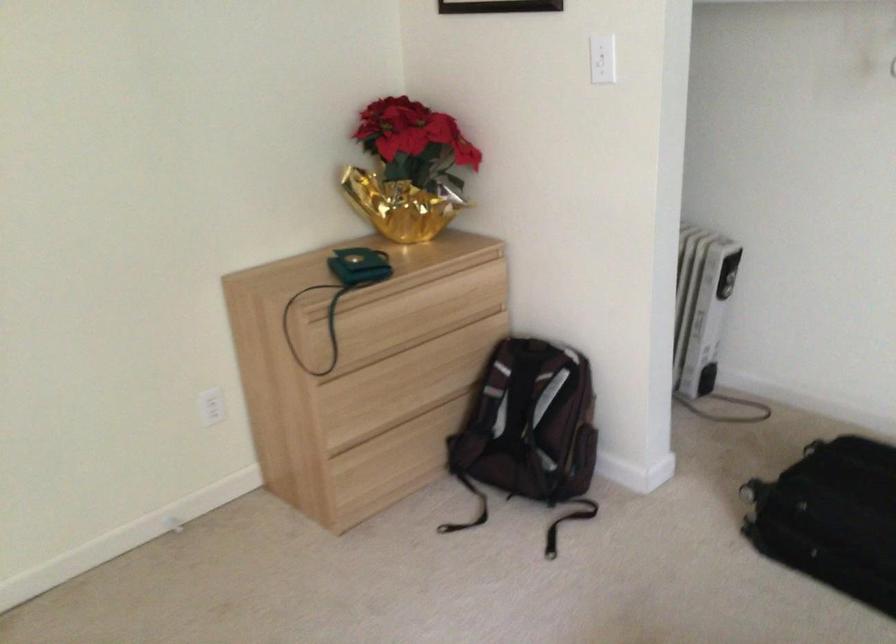
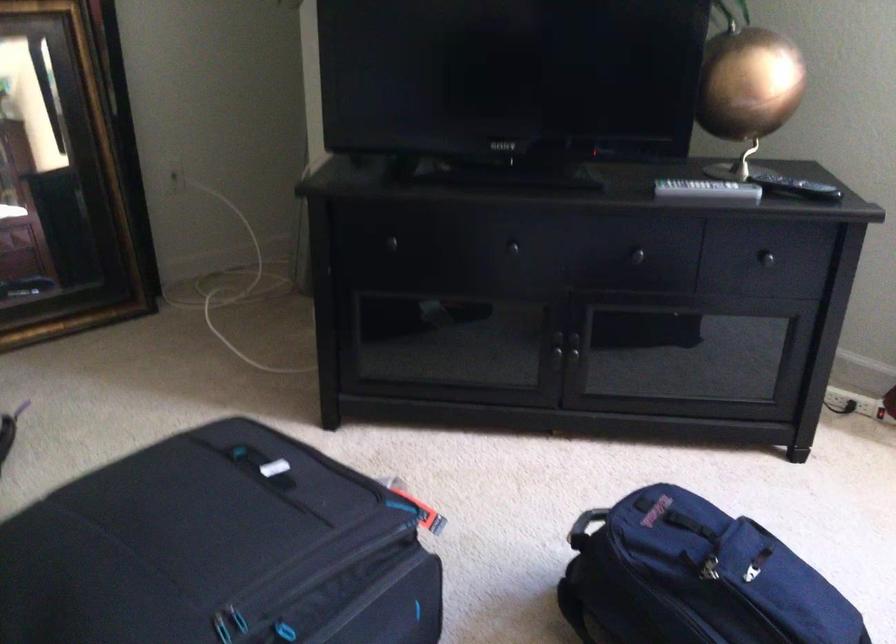
Question: The camera is either moving clockwise (left) or counter-clockwise (right) around the object. The first image is from the beginning of the video and the second image is from the end. Is the camera moving left or right when shooting the video?

Choices:
 (A) Left
 (B) Right

Answer: (A)